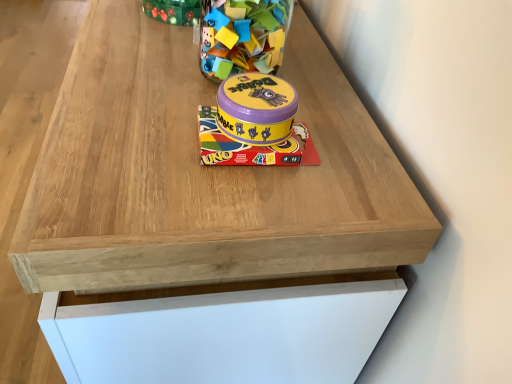
Locate an element on the screen. This screenshot has height=384, width=512. vacant space behind matte purple tin at center, which appears as the 1th toy when viewed from the front is located at coordinates (276, 71).